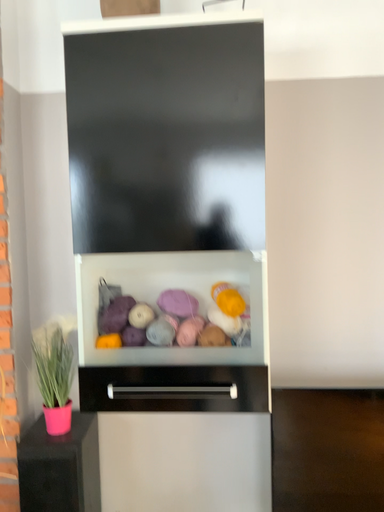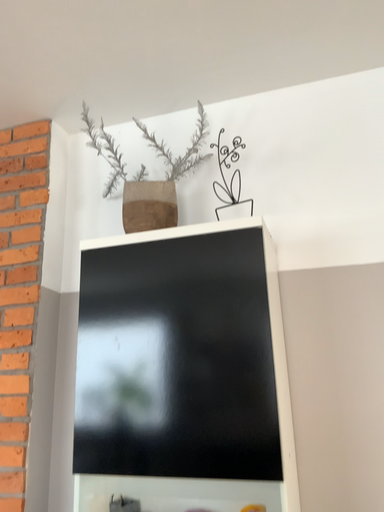
Question: Which way did the camera rotate in the video?

Choices:
 (A) rotated right
 (B) rotated left

Answer: (B)